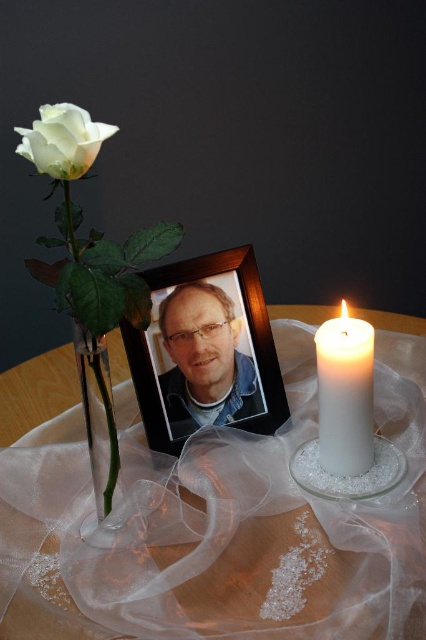
You are arranging items on the wooden table at center and need to place the matte black photo frame at center. Considering their sizes, will the entire frame fit entirely on the table without overhanging the edges?

The wooden table at center is wider than the matte black photo frame at center, so the entire frame will fit on the table without overhanging the edges.

You are organizing a memorial service and need to place a candle on the wooden table at center. Considering the matte black photo frame at center is already there, where should you place the candle to avoid covering the frame?

Since the wooden table at center is larger in size than the matte black photo frame at center, you can place the candle on the table away from the frame, ensuring it doesn not cover the frame.